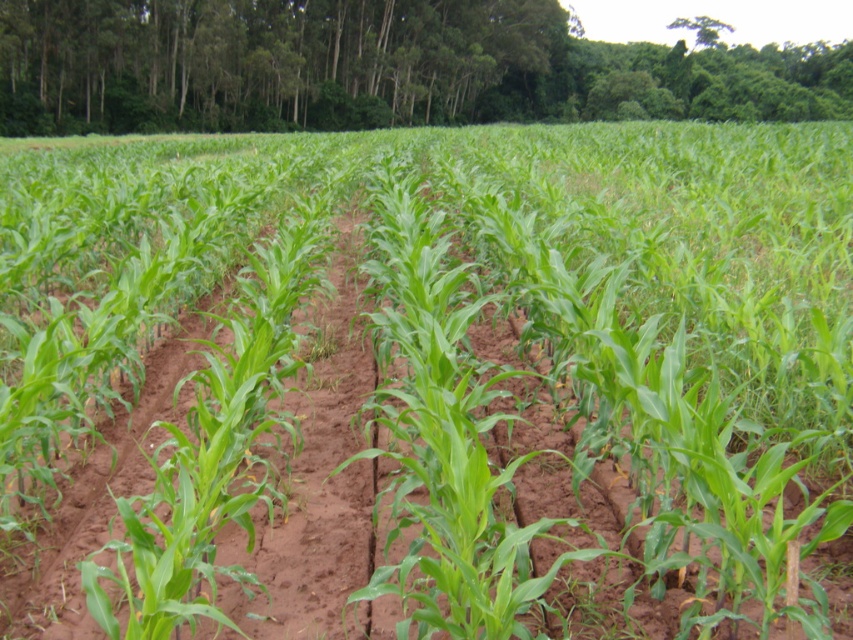
Question: Which point is farther to the camera?

Choices:
 (A) (465, 67)
 (B) (688, 19)

Answer: (B)

Question: Observing the image, what is the correct spatial positioning of green leafy trees at upper center in reference to green leafy tree at upper center?

Choices:
 (A) above
 (B) below

Answer: (B)

Question: Is green leafy trees at upper center positioned before green leafy tree at upper center?

Choices:
 (A) yes
 (B) no

Answer: (A)

Question: Does green leafy trees at upper center have a larger size compared to green leafy tree at upper center?

Choices:
 (A) yes
 (B) no

Answer: (A)

Question: Which point appears closest to the camera in this image?

Choices:
 (A) [720, 24]
 (B) [332, 8]

Answer: (B)